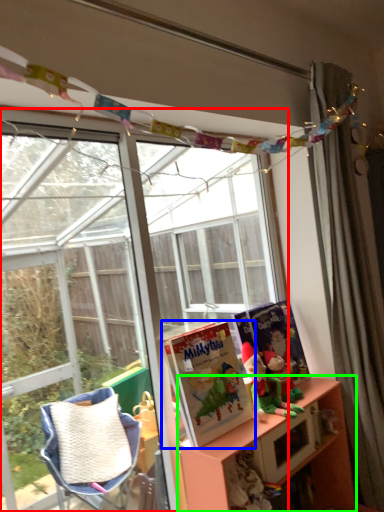
Question: Considering the real-world distances, which object is farthest from window (highlighted by a red box)? book (highlighted by a blue box) or shelf (highlighted by a green box)?

Choices:
 (A) book
 (B) shelf

Answer: (B)